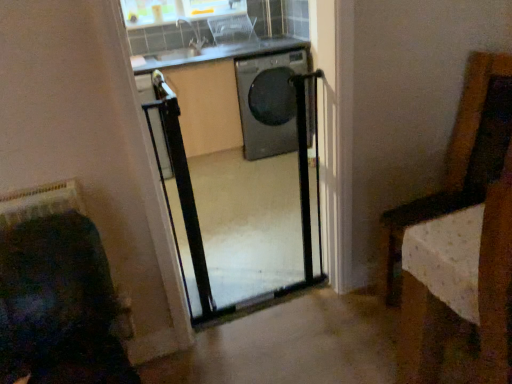
Question: From the image's perspective, is black metal screen door at center located beneath black glossy washing machine at center?

Choices:
 (A) yes
 (B) no

Answer: (A)

Question: Considering the relative sizes of black metal screen door at center and black glossy washing machine at center in the image provided, is black metal screen door at center bigger than black glossy washing machine at center?

Choices:
 (A) no
 (B) yes

Answer: (A)

Question: Is black metal screen door at center thinner than black glossy washing machine at center?

Choices:
 (A) yes
 (B) no

Answer: (A)

Question: Would you say black metal screen door at center contains black glossy washing machine at center?

Choices:
 (A) no
 (B) yes

Answer: (A)

Question: Can you confirm if black metal screen door at center is taller than black glossy washing machine at center?

Choices:
 (A) no
 (B) yes

Answer: (B)

Question: Is clear plastic basket at upper center to the left or to the right of transparent plastic window at upper center in the image?

Choices:
 (A) left
 (B) right

Answer: (B)

Question: Considering the positions of clear plastic basket at upper center and transparent plastic window at upper center in the image, is clear plastic basket at upper center bigger or smaller than transparent plastic window at upper center?

Choices:
 (A) small
 (B) big

Answer: (B)

Question: From a real-world perspective, is clear plastic basket at upper center above or below transparent plastic window at upper center?

Choices:
 (A) above
 (B) below

Answer: (B)

Question: Is clear plastic basket at upper center inside the boundaries of transparent plastic window at upper center, or outside?

Choices:
 (A) inside
 (B) outside

Answer: (B)

Question: Considering their positions, is black glossy washing machine at center located in front of or behind transparent plastic window at upper center?

Choices:
 (A) behind
 (B) front

Answer: (B)

Question: From the image's perspective, is black glossy washing machine at center above or below transparent plastic window at upper center?

Choices:
 (A) above
 (B) below

Answer: (B)

Question: Is black glossy washing machine at center to the left or to the right of transparent plastic window at upper center in the image?

Choices:
 (A) right
 (B) left

Answer: (A)

Question: Would you say black glossy washing machine at center is inside or outside transparent plastic window at upper center?

Choices:
 (A) inside
 (B) outside

Answer: (B)

Question: From their relative heights in the image, would you say black metal screen door at center is taller or shorter than clear plastic basket at upper center?

Choices:
 (A) short
 (B) tall

Answer: (B)

Question: From a real-world perspective, is black metal screen door at center physically located above or below clear plastic basket at upper center?

Choices:
 (A) above
 (B) below

Answer: (B)